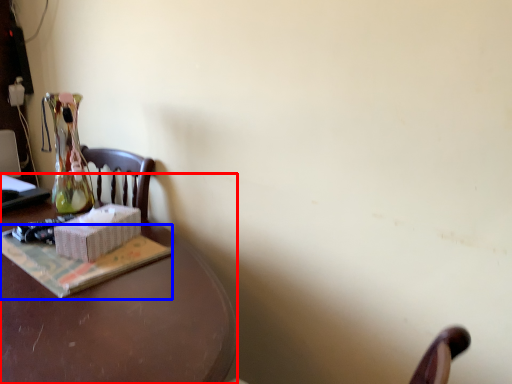
Question: Which of the following is the farthest to the observer, desk (highlighted by a red box) or paperback book (highlighted by a blue box)?

Choices:
 (A) desk
 (B) paperback book

Answer: (B)